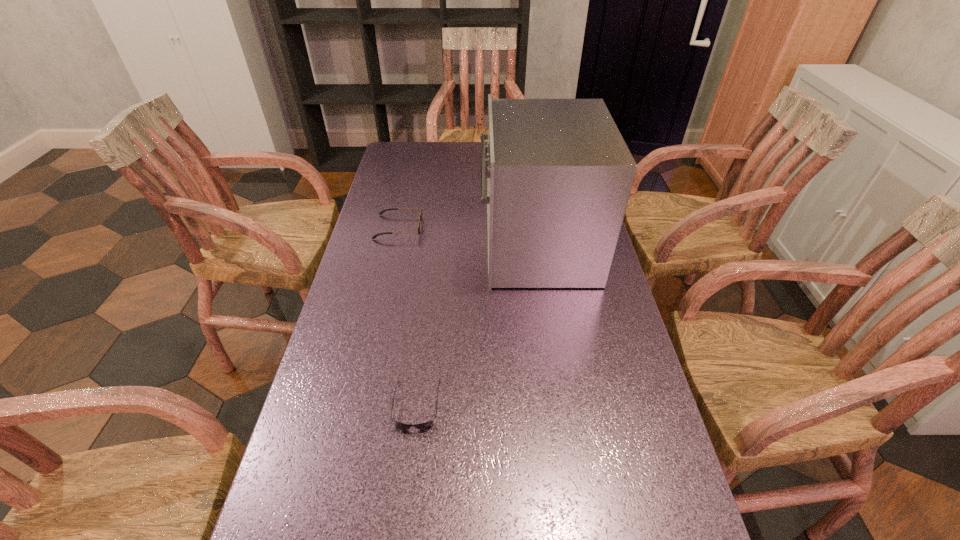
Identify the location of toaster oven. The width and height of the screenshot is (960, 540). (559, 174).

At what (x,y) coordinates should I click in order to perform the action: click on the rightmost object. Please return your answer as a coordinate pair (x, y). The width and height of the screenshot is (960, 540). Looking at the image, I should click on (559, 174).

The height and width of the screenshot is (540, 960). I want to click on the leftmost object, so click(421, 215).

Locate an element on the screen. The image size is (960, 540). the taller sunglasses is located at coordinates (421, 215).

Identify the location of the nearest object. The height and width of the screenshot is (540, 960). (429, 424).

I want to click on the second object from right to left, so click(x=429, y=424).

Locate an element on the screen. free space located on the front panel of the toaster oven is located at coordinates point(372,246).

Locate an element on the screen. This screenshot has height=540, width=960. vacant area situated on the front panel of the toaster oven is located at coordinates (424, 246).

Identify the location of vacant space situated on the front panel of the toaster oven. (381, 246).

The image size is (960, 540). I want to click on free space located 0.330m on the front-facing side of the leftmost object, so click(x=525, y=227).